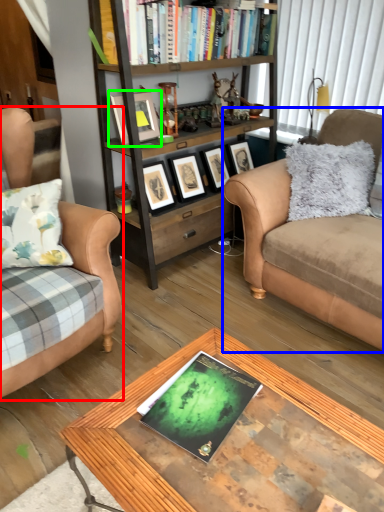
Question: Which object is positioned farthest from studio couch (highlighted by a red box)? Select from studio couch (highlighted by a blue box) and picture frame (highlighted by a green box).

Choices:
 (A) studio couch
 (B) picture frame

Answer: (A)